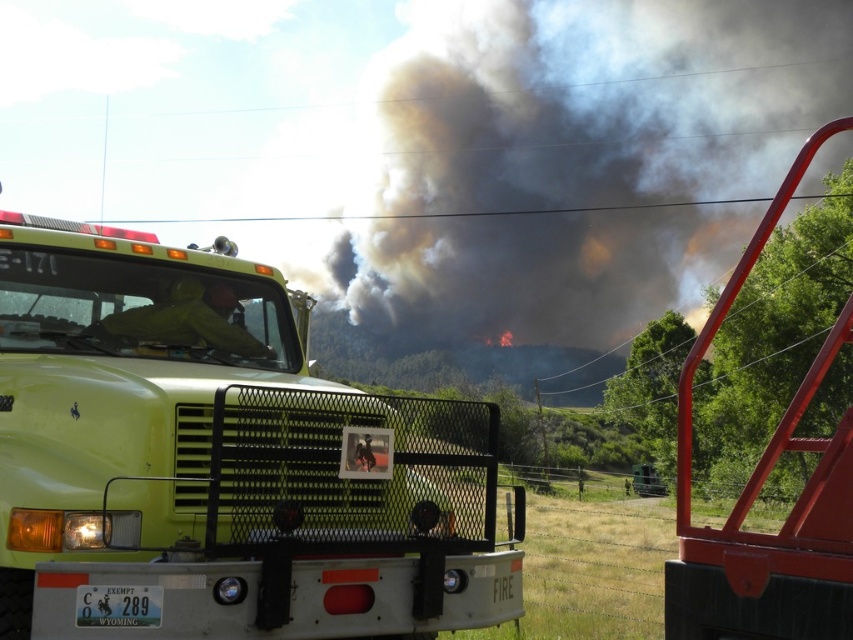
You are a firefighter trying to position your green matte fire truck at center to block the fire. The fire is spreading towards the right side of the image. Based on the truck location coordinates, which direction should you move the truck to block the fire effectively?

The green matte fire truck at center is located at coordinates 0.720 on the x axis and 0.258 on the y axis. Since the fire is spreading to the right side of the image, you should move the truck to the right to block it effectively.

From the picture: You are a firefighter assessing the situation from a safe distance. You notice the green matte fire truck at center and the dark gray smoke at upper center. Which object is taller in the image?

The dark gray smoke at upper center is taller than the green matte fire truck at center.